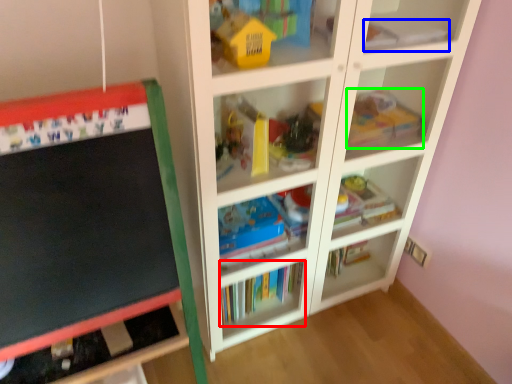
Question: Considering the real-world distances, which object is farthest from book (highlighted by a red box)? book (highlighted by a blue box) or toy (highlighted by a green box)?

Choices:
 (A) book
 (B) toy

Answer: (A)